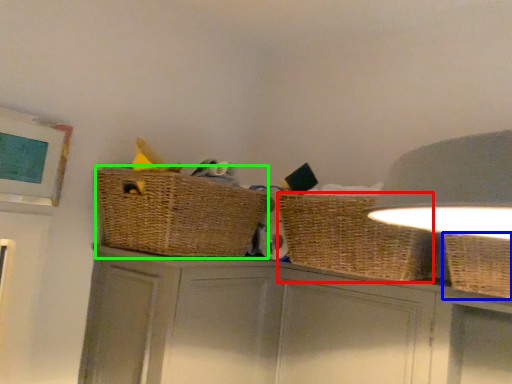
Question: Estimate the real-world distances between objects in this image. Which object is closer to basket (highlighted by a red box), basket (highlighted by a blue box) or basket container (highlighted by a green box)?

Choices:
 (A) basket
 (B) basket container

Answer: (A)